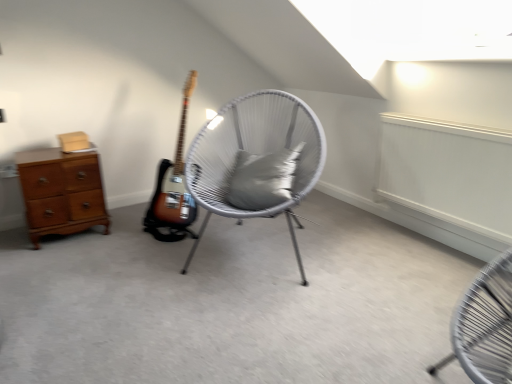
What do you see at coordinates (262, 179) in the screenshot?
I see `gray fabric pillow at center` at bounding box center [262, 179].

Locate an element on the screen. wooden chest of drawers at left is located at coordinates (61, 192).

This screenshot has width=512, height=384. I want to click on gray fabric pillow at center, so click(262, 179).

From the picture: Is gray fabric pillow at center inside the boundaries of wooden chest of drawers at left, or outside?

gray fabric pillow at center cannot be found inside wooden chest of drawers at left.

Which is more to the left, gray fabric pillow at center or wooden chest of drawers at left?

wooden chest of drawers at left is more to the left.

Identify the location of pillow above the wooden chest of drawers at left (from the image's perspective). (262, 179).

Between gray fabric pillow at center and wooden chest of drawers at left, which one has larger size?

wooden chest of drawers at left is bigger.

Considering the positions of points (36, 176) and (231, 202), is point (36, 176) farther from camera compared to point (231, 202)?

Yes, it is.

From a real-world perspective, is wooden chest of drawers at left located beneath gray fabric pillow at center?

Yes, from a real-world perspective, wooden chest of drawers at left is beneath gray fabric pillow at center.

Considering the sizes of wooden chest of drawers at left and gray fabric pillow at center in the image, is wooden chest of drawers at left taller or shorter than gray fabric pillow at center?

wooden chest of drawers at left is taller than gray fabric pillow at center.

Is wooden chest of drawers at left positioned with its back to gray fabric pillow at center?

No, wooden chest of drawers at left is not facing away from gray fabric pillow at center.

Does white woven chair at center have a larger size compared to wooden chest of drawers at left?

Yes, white woven chair at center is bigger than wooden chest of drawers at left.

I want to click on chair that is in front of the wooden chest of drawers at left, so click(x=255, y=154).

How many degrees apart are the facing directions of white woven chair at center and wooden chest of drawers at left?

The angular difference between white woven chair at center and wooden chest of drawers at left is 40.6 degrees.

From the image's perspective, does white woven chair at center appear lower than wooden chest of drawers at left?

No, from the image's perspective, white woven chair at center is not below wooden chest of drawers at left.

Based on their positions, is wooden chest of drawers at left located to the left or right of white woven chair at center?

Clearly, wooden chest of drawers at left is on the left of white woven chair at center in the image.

Considering the sizes of objects wooden chest of drawers at left and white woven chair at center in the image provided, who is wider, wooden chest of drawers at left or white woven chair at center?

white woven chair at center is wider.

In the scene shown: In terms of height, does wooden chest of drawers at left look taller or shorter compared to white woven chair at center?

In the image, wooden chest of drawers at left appears to be shorter than white woven chair at center.

Is wooden chest of drawers at left oriented towards white woven chair at center?

No, wooden chest of drawers at left is not turned towards white woven chair at center.

Looking at this image, between white woven chair at center and gray fabric pillow at center, which one has larger size?

white woven chair at center is bigger.

Find the location of a particular element. The height and width of the screenshot is (384, 512). chair that is on the left side of gray fabric pillow at center is located at coordinates (255, 154).

From a real-world perspective, which object rests below the other?

white woven chair at center, from a real-world perspective.

Considering the relative sizes of white woven chair at center and gray fabric pillow at center in the image provided, is white woven chair at center thinner than gray fabric pillow at center?

Incorrect, the width of white woven chair at center is not less than that of gray fabric pillow at center.

Is gray fabric pillow at center not close to white woven chair at center?

gray fabric pillow at center is actually quite close to white woven chair at center.

Who is shorter, gray fabric pillow at center or white woven chair at center?

gray fabric pillow at center is shorter.

Which object is positioned more to the right, gray fabric pillow at center or white woven chair at center?

gray fabric pillow at center.

This screenshot has width=512, height=384. In order to click on pillow above the wooden chest of drawers at left (from a real-world perspective) in this screenshot , I will do `click(262, 179)`.

Locate an element on the screen. This screenshot has width=512, height=384. the chest of drawers below the gray fabric pillow at center (from a real-world perspective) is located at coordinates (61, 192).

Based on their spatial positions, is wooden chest of drawers at left or white woven chair at center closer to gray fabric pillow at center?

white woven chair at center lies closer to gray fabric pillow at center than the other object.

From the image, which object appears to be nearer to white woven chair at center, gray fabric pillow at center or wooden chest of drawers at left?

The object closer to white woven chair at center is gray fabric pillow at center.

Looking at the image, which one is located further to wooden chest of drawers at left, gray fabric pillow at center or white woven chair at center?

The object further to wooden chest of drawers at left is gray fabric pillow at center.

From the image, which object appears to be nearer to gray fabric pillow at center, white woven chair at center or wooden chest of drawers at left?

white woven chair at center lies closer to gray fabric pillow at center than the other object.

Based on their spatial positions, is white woven chair at center or gray fabric pillow at center closer to wooden chest of drawers at left?

white woven chair at center.

From the image, which object appears to be farther from white woven chair at center, wooden chest of drawers at left or gray fabric pillow at center?

wooden chest of drawers at left is positioned further to the anchor white woven chair at center.

Identify the location of chair situated between wooden chest of drawers at left and gray fabric pillow at center from left to right. (255, 154).